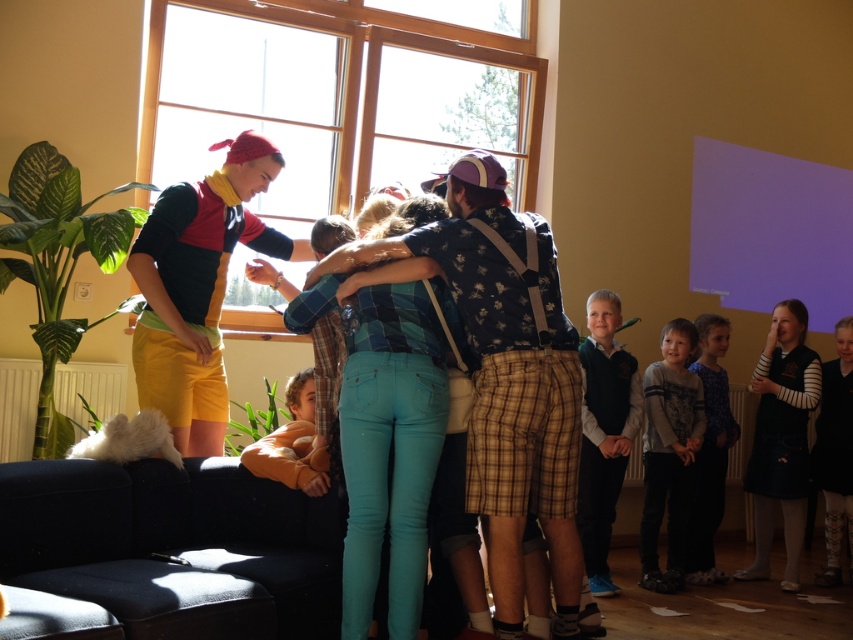
You are a photographer trying to capture a photo of the blue denim jeans at center and the dark blue sweater at lower right. You want to ensure both items are visible in the frame. Based on their positions, which item should you focus on first to ensure both are in the shot?

The blue denim jeans at center is positioned on the left side of dark blue sweater at lower right. Therefore, focusing on the blue denim jeans at center first will allow you to frame it on the left, then adjust to include the dark blue sweater at lower right on the right side.

You are organizing a small gathering and need to place a black wool sweater at right on the dark blue fabric couch at lower left. Will the sweater fit on the couch?

The dark blue fabric couch at lower left is larger in size than the black wool sweater at right, so the sweater will fit comfortably on the couch.